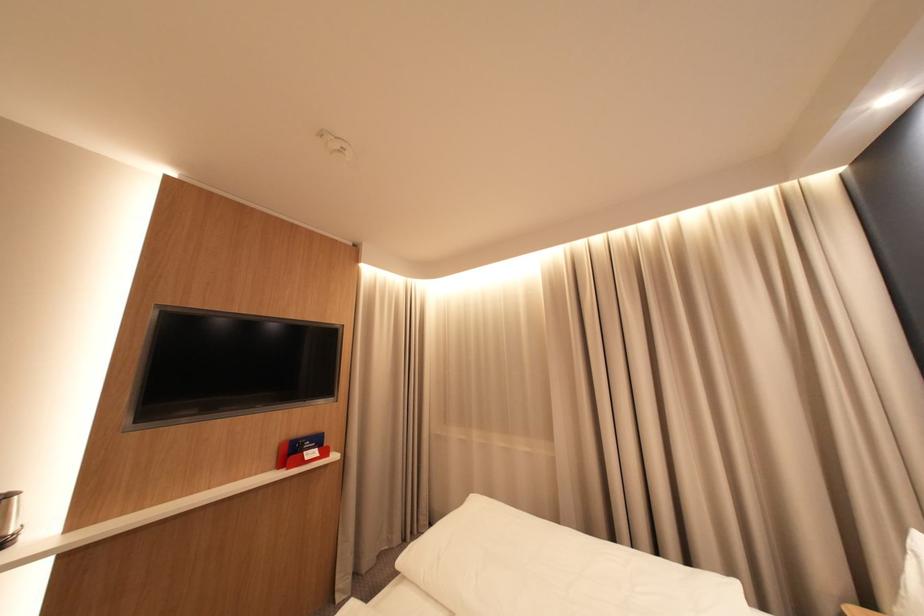
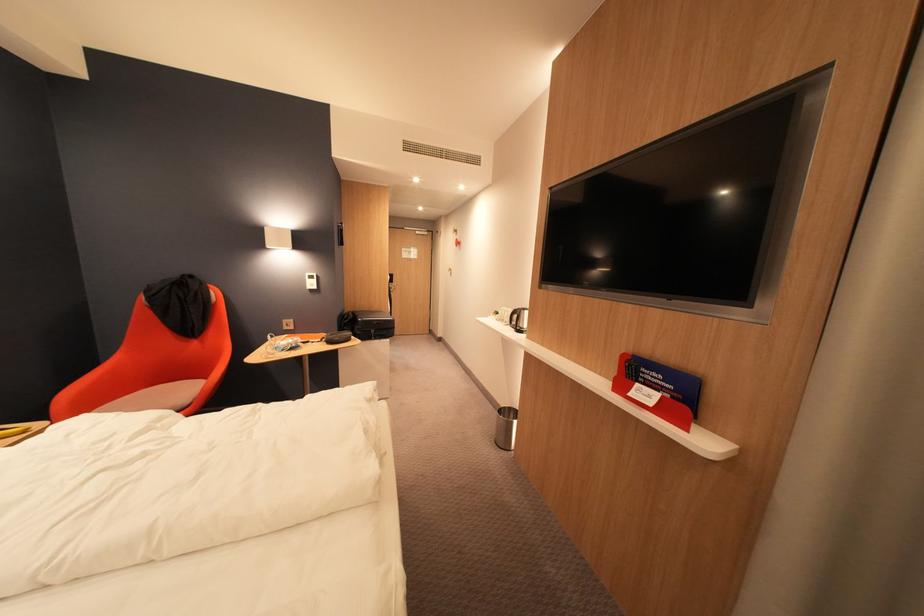
In the second image, find the point that corresponds to (314,455) in the first image.

(648, 386)